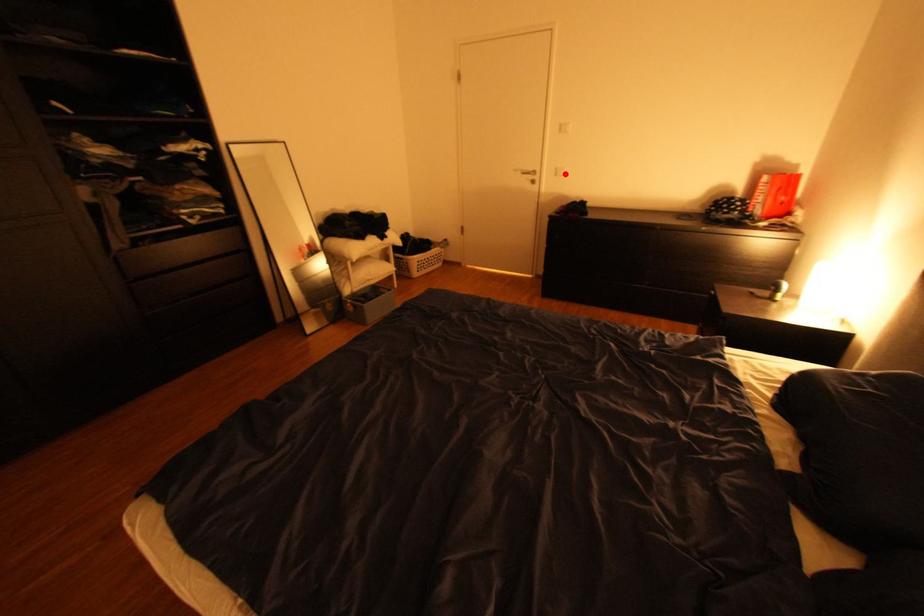
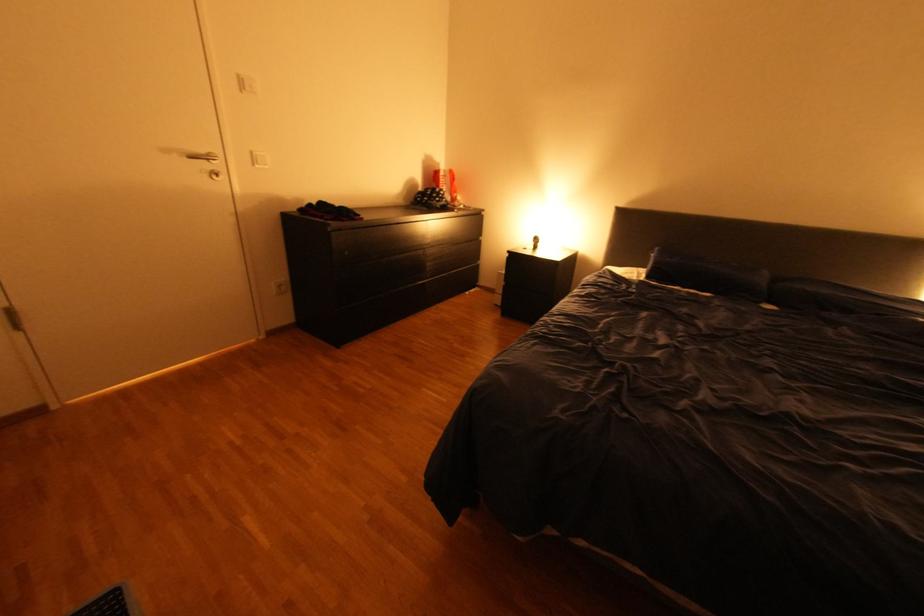
In the second image, find the point that corresponds to the highlighted location in the first image.

(264, 161)